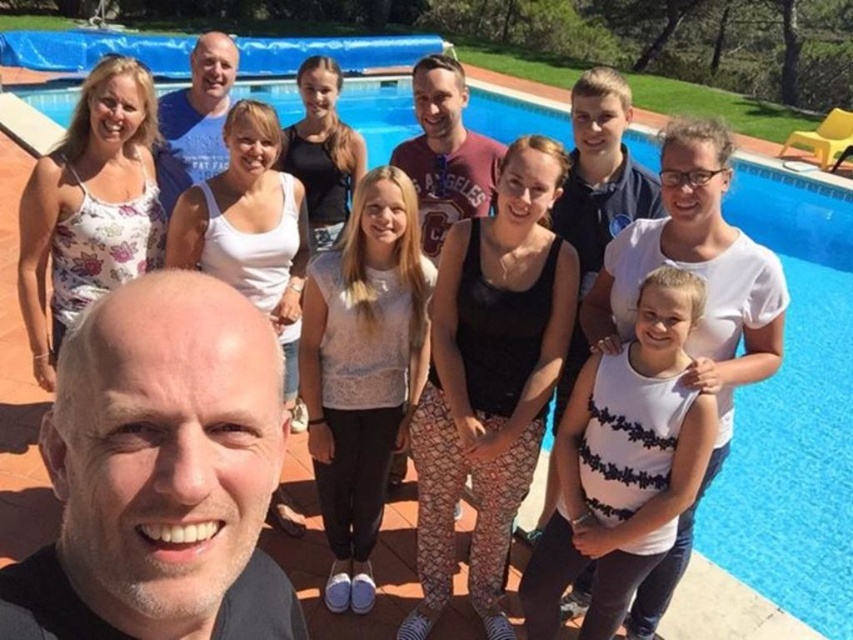
Question: Can you confirm if white dotted tank top at center is thinner than matte red t-shirt at center?

Choices:
 (A) no
 (B) yes

Answer: (A)

Question: Which of these objects is positioned closest to the matte red shirt at center?

Choices:
 (A) blue cotton t-shirt at center
 (B) matte red t-shirt at center
 (C) white dotted tank top at center
 (D) white textured tank top at center

Answer: (B)

Question: Which object appears closest to the camera in this image?

Choices:
 (A) matte red t-shirt at center
 (B) smooth skin face at lower left
 (C) white textured tank top at center

Answer: (B)

Question: Can you confirm if white textured tank top at center is positioned to the left of matte red shirt at center?

Choices:
 (A) yes
 (B) no

Answer: (A)

Question: Can you confirm if smooth skin face at lower left is positioned to the right of white textured tank top at center?

Choices:
 (A) yes
 (B) no

Answer: (A)

Question: Which object is farther from the camera taking this photo?

Choices:
 (A) matte red t-shirt at center
 (B) blue cotton t-shirt at center
 (C) white dotted tank top at center

Answer: (B)